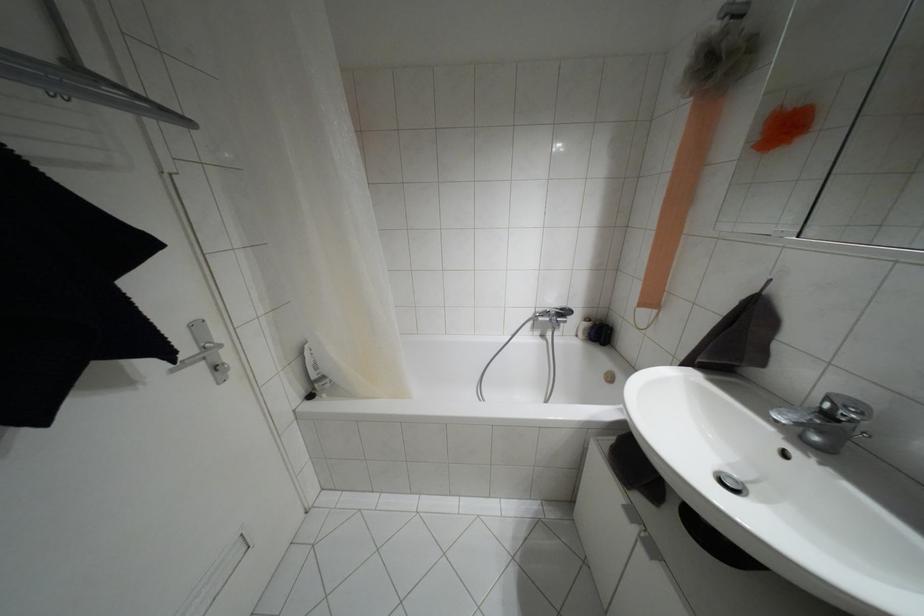
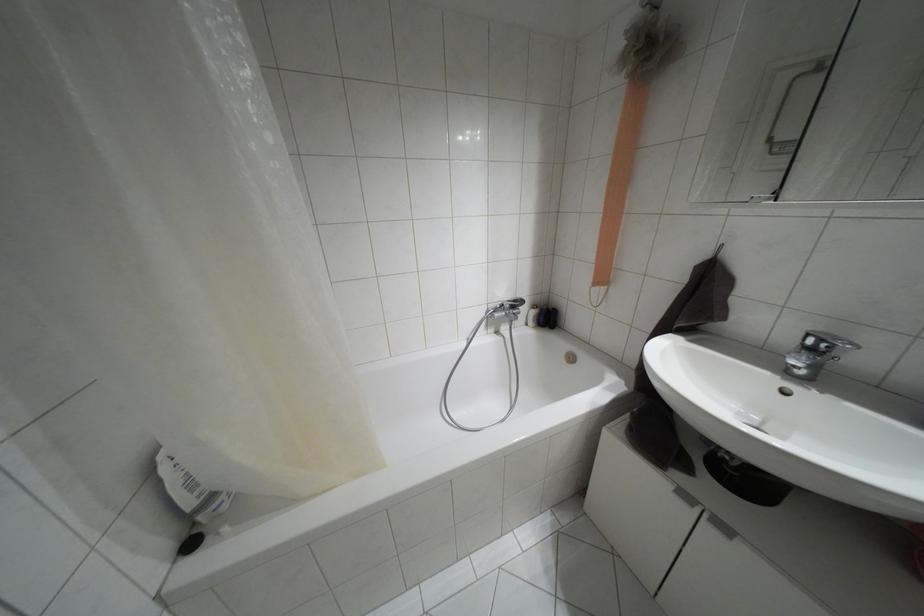
Question: The camera is either moving clockwise (left) or counter-clockwise (right) around the object. The first image is from the beginning of the video and the second image is from the end. Is the camera moving left or right when shooting the video?

Choices:
 (A) Left
 (B) Right

Answer: (A)